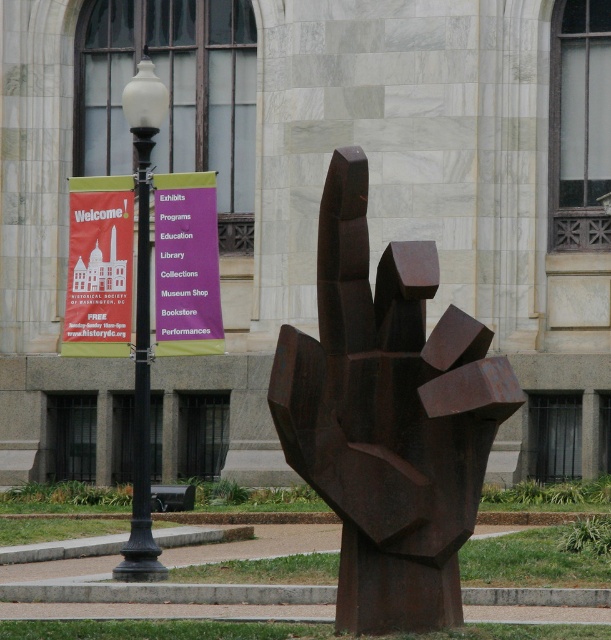
Does rusty metal hand at center have a greater height compared to matte red banner at left?

Yes, rusty metal hand at center is taller than matte red banner at left.

Does point (331, 272) come closer to viewer compared to point (89, 285)?

Yes.

Where is `rusty metal hand at center`? The height and width of the screenshot is (640, 611). rusty metal hand at center is located at coordinates (x=389, y=417).

Identify the location of rusty metal hand at center. The image size is (611, 640). (389, 417).

Between matte red banner at left and purple matte sign at upper center, which one appears on the left side from the viewer's perspective?

matte red banner at left

Can you confirm if matte red banner at left is thinner than purple matte sign at upper center?

No, matte red banner at left is not thinner than purple matte sign at upper center.

Which is in front, point (68, 179) or point (180, 292)?

Positioned in front is point (180, 292).

The height and width of the screenshot is (640, 611). Identify the location of matte red banner at left. (98, 266).

Which is below, rusty metal hand at center or purple matte sign at upper center?

rusty metal hand at center is lower down.

Can you confirm if rusty metal hand at center is positioned above purple matte sign at upper center?

Actually, rusty metal hand at center is below purple matte sign at upper center.

Image resolution: width=611 pixels, height=640 pixels. Identify the location of rusty metal hand at center. (389, 417).